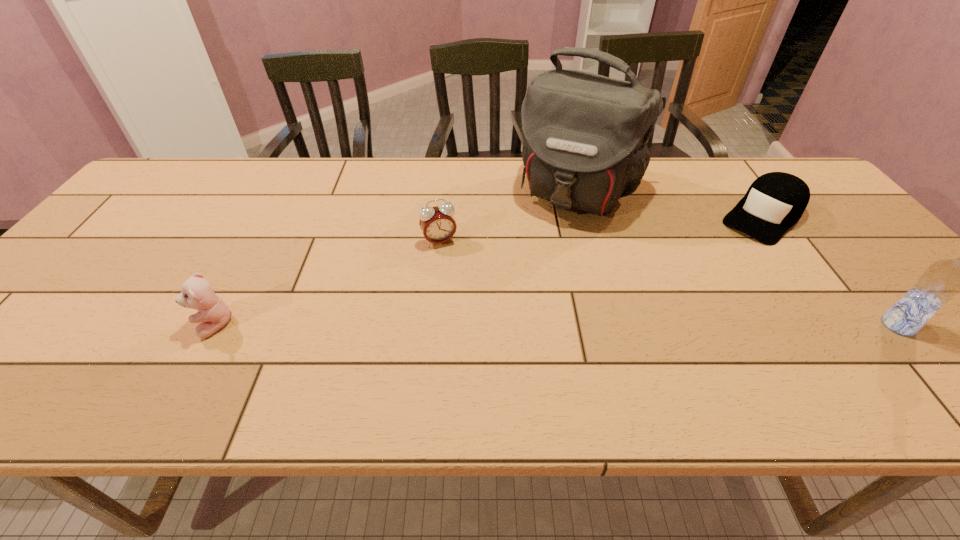
The height and width of the screenshot is (540, 960). Find the location of `vacant space on the desktop that is between the leftmost object and the vodka and is positioned on the front-facing side of the shortest object`. vacant space on the desktop that is between the leftmost object and the vodka and is positioned on the front-facing side of the shortest object is located at coordinates (648, 325).

Where is `free space on the desktop that is between the teddy bear and the second tallest object and is positioned on the clock face of the second object from left to right`? free space on the desktop that is between the teddy bear and the second tallest object and is positioned on the clock face of the second object from left to right is located at coordinates (475, 326).

You are a GUI agent. You are given a task and a screenshot of the screen. Output one action in this format:
    pyautogui.click(x=<x>, y=<y>)
    Task: Click on the vacant space on the desktop that is between the leftmost object and the fourth shortest object and is positioned on the open flap of the shoulder bag
    The height and width of the screenshot is (540, 960).
    Given the screenshot: What is the action you would take?
    point(499,326)